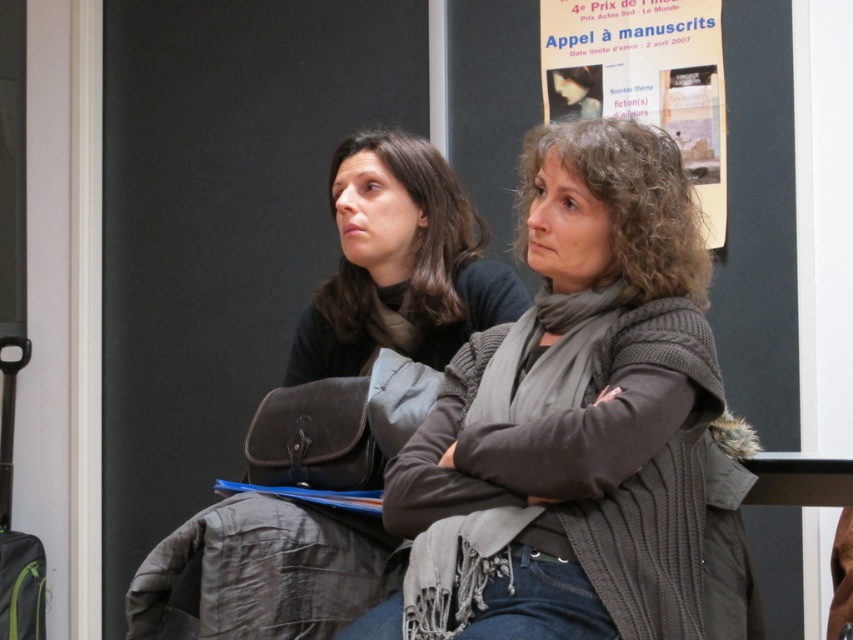
Question: Estimate the real-world distances between objects in this image. Which object is closer to the matte black jacket at center?

Choices:
 (A) knitted gray sweater at center
 (B) paper poster at upper center

Answer: (A)

Question: Considering the real-world distances, which object is closest to the knitted gray sweater at center?

Choices:
 (A) paper poster at upper center
 (B) matte black jacket at center

Answer: (B)

Question: Is knitted gray sweater at center further to camera compared to matte black jacket at center?

Choices:
 (A) no
 (B) yes

Answer: (A)

Question: Can you confirm if knitted gray sweater at center is positioned to the right of paper poster at upper center?

Choices:
 (A) yes
 (B) no

Answer: (B)

Question: Which point appears farthest from the camera in this image?

Choices:
 (A) (560, 113)
 (B) (403, 268)
 (C) (450, 396)

Answer: (A)

Question: Is knitted gray sweater at center smaller than matte black jacket at center?

Choices:
 (A) yes
 (B) no

Answer: (B)